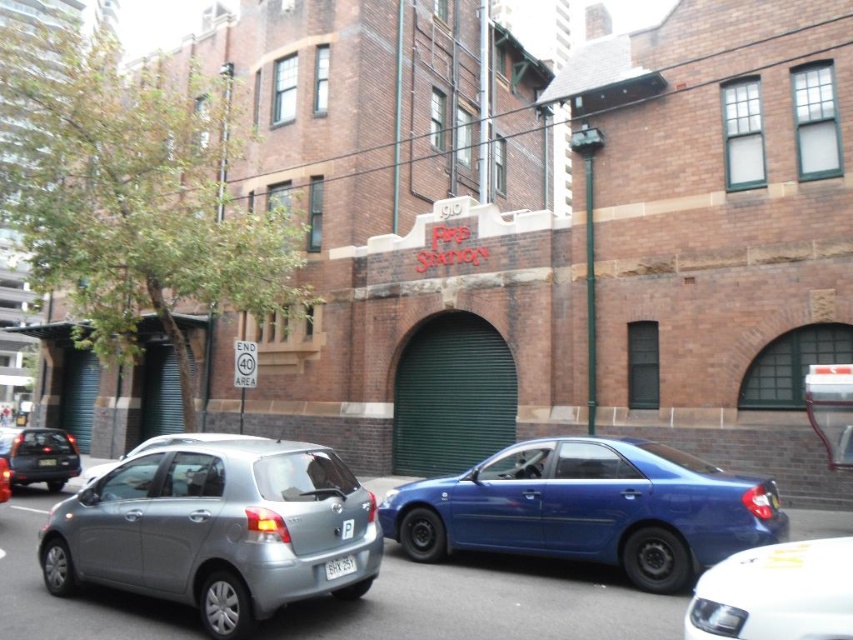
You are a delivery person trying to park your van which is 2 meters tall. You see the satin silver hatchback at lower left and the matte black sedan at left in front of the fire station. Can your van fit between them without hitting the vehicles?

The satin silver hatchback at lower left is taller than the matte black sedan at left. Since your van is 2 meters tall, you need to check the height clearance between them. However, the description only provides relative height between the two cars, not the actual space between them. Without knowing the distance or available vertical space between the vehicles, it is impossible to determine if the van can fit.

You are a delivery person trying to park your van in front of the 1910 Fire Station. You see the satin silver hatchback at lower left and the matte black sedan at left. Which vehicle should you move first to create space for your van?

You should move the satin silver hatchback at lower left first because it is closer to you than the matte black sedan at left, so moving it first will free up more space for your van.

You are a delivery driver who needs to park your 2.5 meter long van between the white glossy sedan at center and the white plastic license plate at lower center. Can you fit your van there without overlapping either object?

The distance between the white glossy sedan at center and the white plastic license plate at lower center is 3.01 meters. Since your van is 2.5 meters long, there is enough space to park it between them without overlapping either object.